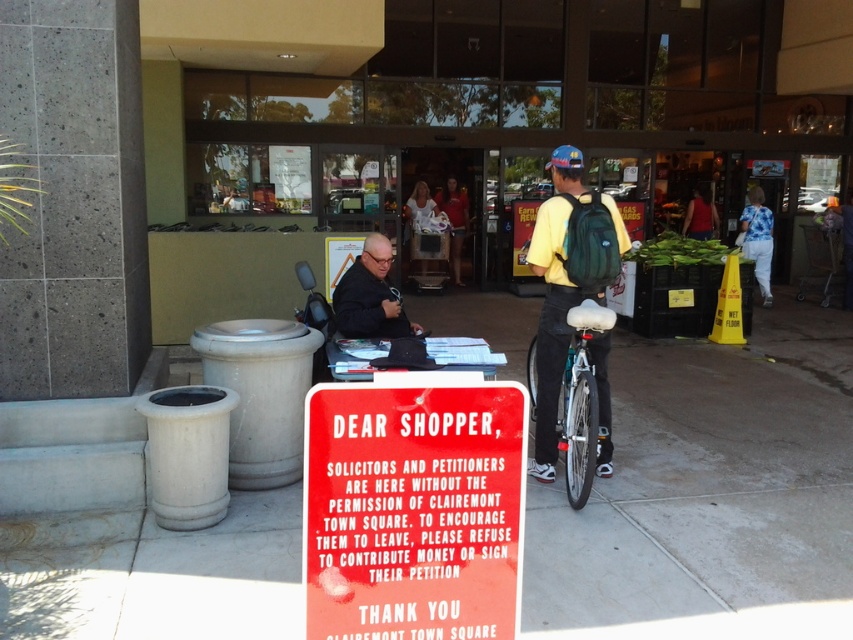
Question: Can you confirm if green fabric backpack at right is positioned to the left of black matte shirt at center?

Choices:
 (A) yes
 (B) no

Answer: (B)

Question: Which is nearer to the white cotton shirt at center?

Choices:
 (A) green fabric backpack at right
 (B) black matte shirt at center
 (C) matte red shirt at center

Answer: (C)

Question: Does green fabric backpack at right lie behind matte red shirt at center?

Choices:
 (A) yes
 (B) no

Answer: (B)

Question: Which of these objects is positioned farthest from the black matte shirt at center?

Choices:
 (A) green fabric backpack at right
 (B) blue floral shirt at right

Answer: (B)

Question: Observing the image, what is the correct spatial positioning of green fabric backpack at right in reference to matte red shirt at center?

Choices:
 (A) below
 (B) above

Answer: (A)

Question: Which of the following is the farthest from the observer?

Choices:
 (A) gray concrete pavement at lower center
 (B) white matte bicycle at center
 (C) black matte shirt at center

Answer: (C)